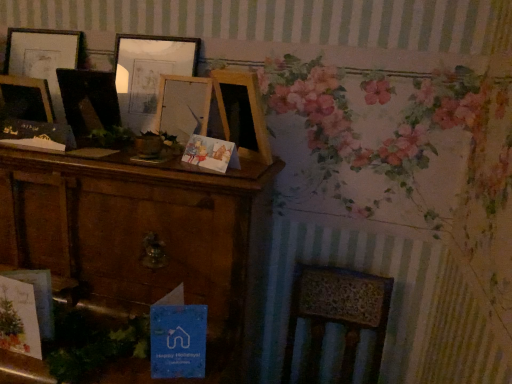
Question: Is blue paper postcard at lower center at the right side of wooden picture frame at center, placed as the first picture frame when sorted from right to left?

Choices:
 (A) no
 (B) yes

Answer: (B)

Question: Is blue paper postcard at lower center thinner than wooden picture frame at center, which is the third picture frame in left-to-right order?

Choices:
 (A) yes
 (B) no

Answer: (B)

Question: Can you confirm if blue paper postcard at lower center is smaller than wooden picture frame at center, which is the third picture frame in left-to-right order?

Choices:
 (A) yes
 (B) no

Answer: (A)

Question: From the image's perspective, is blue paper postcard at lower center beneath wooden picture frame at center, which is the third picture frame in left-to-right order?

Choices:
 (A) no
 (B) yes

Answer: (B)

Question: Is blue paper postcard at lower center positioned beyond the bounds of wooden picture frame at center, which is the third picture frame in left-to-right order?

Choices:
 (A) no
 (B) yes

Answer: (B)

Question: Is point (205, 311) closer or farther from the camera than point (241, 256)?

Choices:
 (A) closer
 (B) farther

Answer: (B)

Question: In terms of size, does blue paper postcard at lower center appear bigger or smaller than brown wood cabinet at left?

Choices:
 (A) big
 (B) small

Answer: (B)

Question: From their relative heights in the image, would you say blue paper postcard at lower center is taller or shorter than brown wood cabinet at left?

Choices:
 (A) short
 (B) tall

Answer: (A)

Question: Considering their positions, is blue paper postcard at lower center located in front of or behind brown wood cabinet at left?

Choices:
 (A) front
 (B) behind

Answer: (B)

Question: Is point (19, 34) closer or farther from the camera than point (147, 84)?

Choices:
 (A) farther
 (B) closer

Answer: (A)

Question: Would you say wooden picture frame at upper left, the third picture frame when ordered from right to left, is to the left or to the right of wooden picture frame at center, which is the third picture frame in left-to-right order, in the picture?

Choices:
 (A) left
 (B) right

Answer: (A)

Question: Based on their sizes in the image, would you say wooden picture frame at upper left, the first picture frame when ordered from left to right, is bigger or smaller than wooden picture frame at center, which is the third picture frame in left-to-right order?

Choices:
 (A) small
 (B) big

Answer: (A)

Question: From the image's perspective, relative to wooden picture frame at center, placed as the first picture frame when sorted from right to left, is wooden picture frame at upper left, the third picture frame when ordered from right to left, above or below?

Choices:
 (A) above
 (B) below

Answer: (A)

Question: From a real-world perspective, is wooden picture frame at upper left, the first picture frame when ordered from left to right, physically located above or below wooden radiator at lower right?

Choices:
 (A) above
 (B) below

Answer: (A)

Question: Is wooden picture frame at upper left, the third picture frame when ordered from right to left, bigger or smaller than wooden radiator at lower right?

Choices:
 (A) big
 (B) small

Answer: (B)